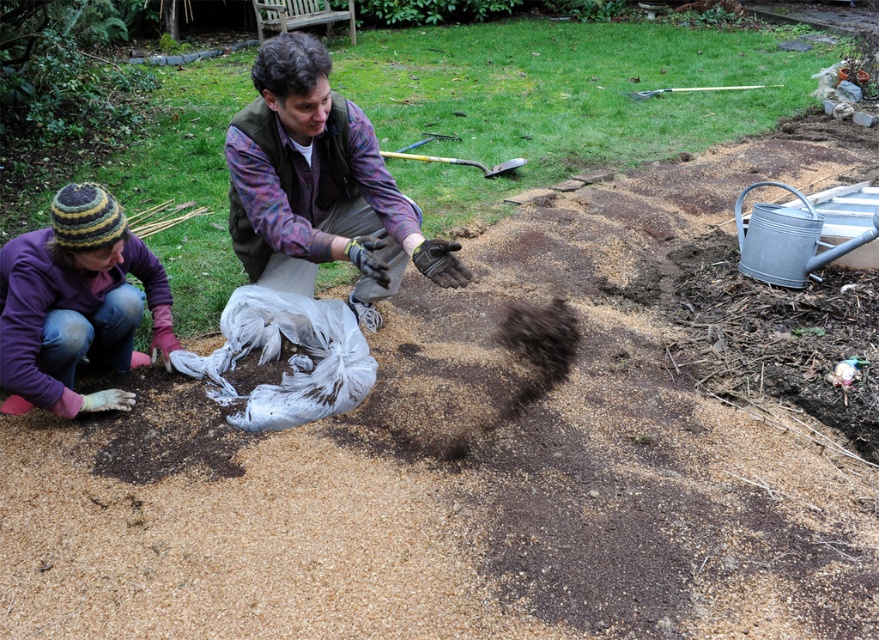
Does flannel shirt at center appear on the right side of metallic silver shovel at upper center?

In fact, flannel shirt at center is to the left of metallic silver shovel at upper center.

Image resolution: width=879 pixels, height=640 pixels. Identify the location of flannel shirt at center. (318, 186).

The height and width of the screenshot is (640, 879). What are the coordinates of `flannel shirt at center` in the screenshot? It's located at (318, 186).

Does point (125, 244) lie behind point (516, 164)?

That is False.

Who is positioned more to the right, purple woolen hat at lower left or metallic silver shovel at upper center?

metallic silver shovel at upper center

The height and width of the screenshot is (640, 879). Identify the location of purple woolen hat at lower left. (76, 301).

Locate an element on the screen. purple woolen hat at lower left is located at coordinates (76, 301).

Is flannel shirt at center positioned before purple woolen hat at lower left?

Yes, it is in front of purple woolen hat at lower left.

Is flannel shirt at center positioned at the back of purple woolen hat at lower left?

A: That is False.

What do you see at coordinates (318, 186) in the screenshot? This screenshot has height=640, width=879. I see `flannel shirt at center` at bounding box center [318, 186].

Identify the location of flannel shirt at center. (318, 186).